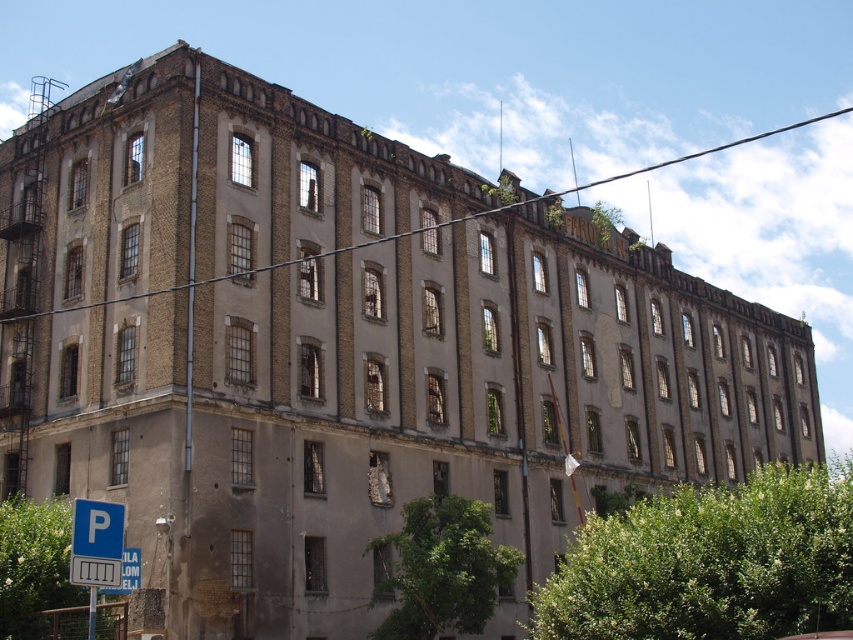
Question: Which object appears closest to the camera in this image?

Choices:
 (A) blue plastic parking sign at lower left
 (B) blue plastic street sign at lower left

Answer: (A)

Question: Is blue plastic parking sign at lower left thinner than blue plastic street sign at lower left?

Choices:
 (A) yes
 (B) no

Answer: (B)

Question: Does blue plastic parking sign at lower left appear on the right side of blue plastic street sign at lower left?

Choices:
 (A) no
 (B) yes

Answer: (B)

Question: Is blue plastic parking sign at lower left behind blue plastic street sign at lower left?

Choices:
 (A) yes
 (B) no

Answer: (B)

Question: Which object appears farthest from the camera in this image?

Choices:
 (A) blue plastic street sign at lower left
 (B) blue plastic parking sign at lower left

Answer: (A)